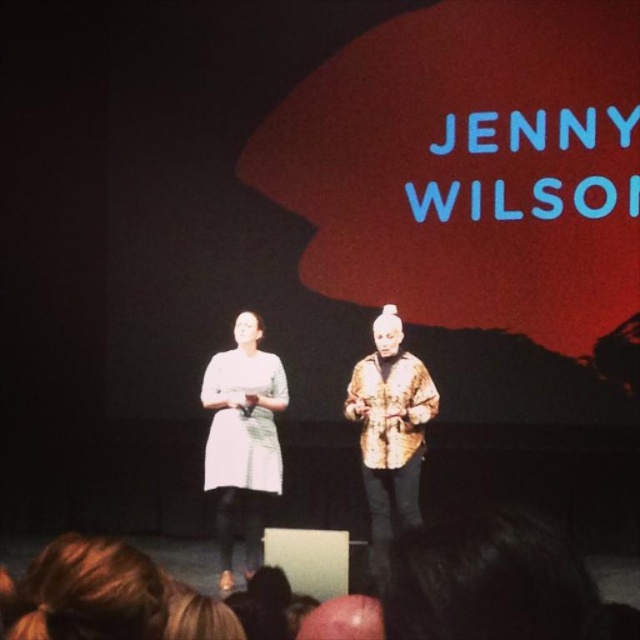
Question: Among these points, which one is nearest to the camera?

Choices:
 (A) click(x=236, y=496)
 (B) click(x=368, y=387)

Answer: (B)

Question: Is matte white dress at center closer to camera compared to floral-patterned jacket at center?

Choices:
 (A) yes
 (B) no

Answer: (B)

Question: From the image, what is the correct spatial relationship of matte white dress at center in relation to floral-patterned jacket at center?

Choices:
 (A) left
 (B) right

Answer: (A)

Question: Considering the relative positions of matte white dress at center and floral-patterned jacket at center in the image provided, where is matte white dress at center located with respect to floral-patterned jacket at center?

Choices:
 (A) right
 (B) left

Answer: (B)

Question: Which of the following is the farthest from the observer?

Choices:
 (A) matte white dress at center
 (B) floral-patterned jacket at center

Answer: (A)